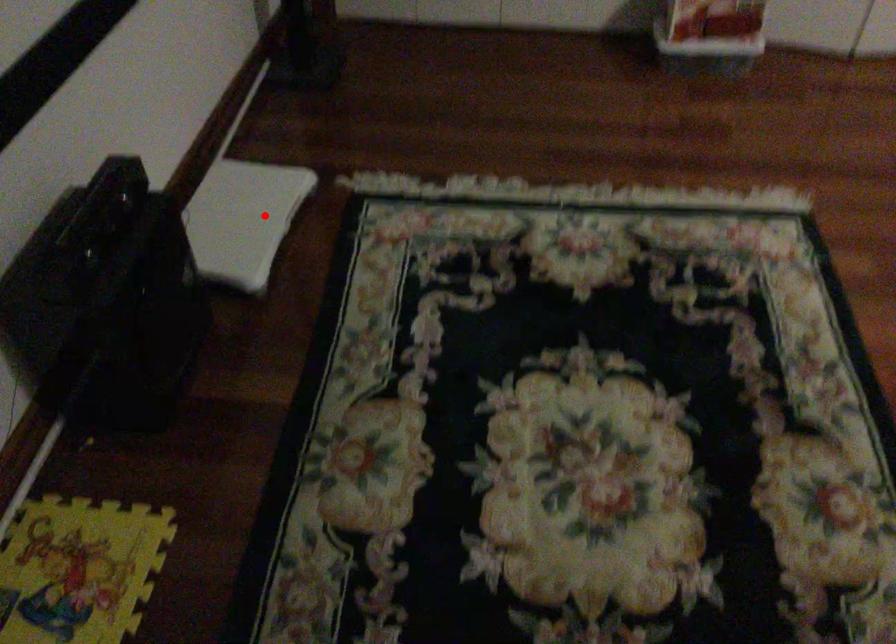
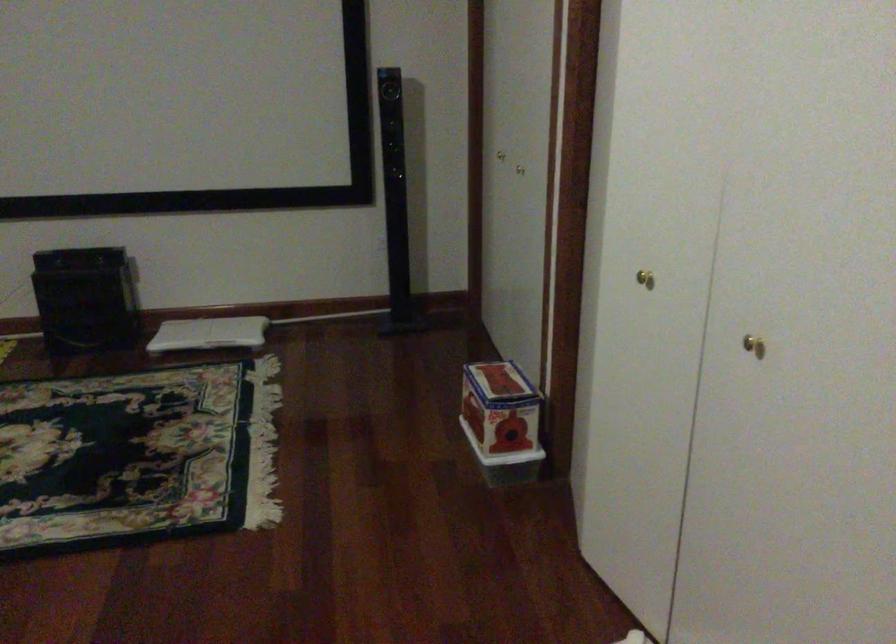
Question: I am providing you with two images of the same scene from different viewpoints. Given a red point in image1, look at the same physical point in image2. Is it:

Choices:
 (A) Closer to the viewpoint
 (B) Farther from the viewpoint

Answer: (B)